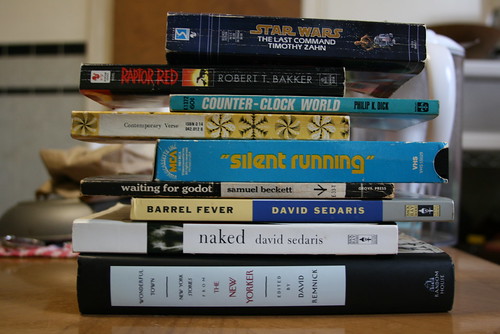
Where is `books dvds and vhs stack`? This screenshot has height=334, width=500. books dvds and vhs stack is located at coordinates (248, 39), (228, 80), (244, 102), (247, 132), (256, 152), (253, 191), (254, 207), (260, 243), (265, 289).